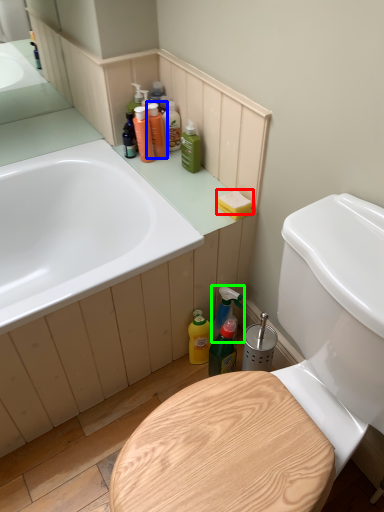
Question: Estimate the real-world distances between objects in this image. Which object is farther from soap (highlighted by a red box), cleaning product (highlighted by a blue box) or cleaning product (highlighted by a green box)?

Choices:
 (A) cleaning product
 (B) cleaning product

Answer: (A)